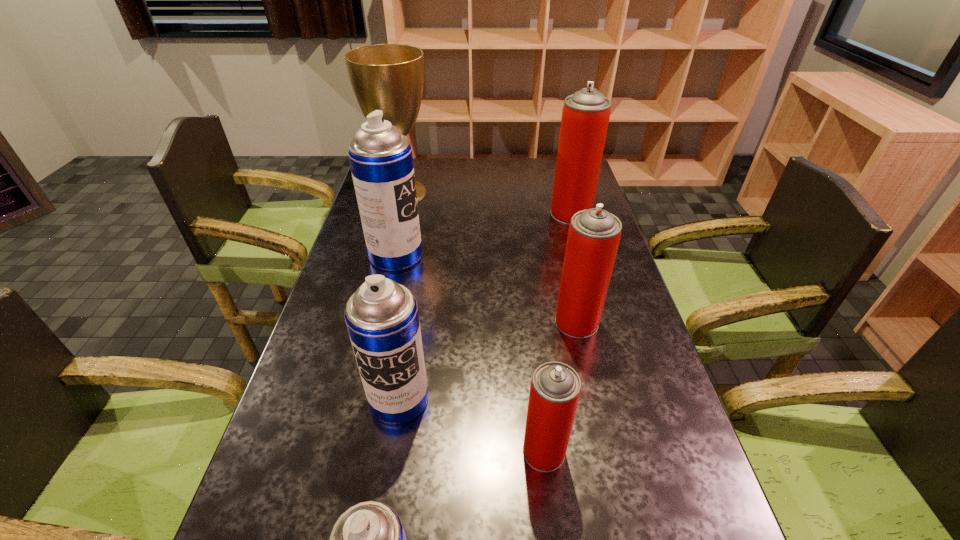
Where is `trophy cup`? The height and width of the screenshot is (540, 960). trophy cup is located at coordinates (389, 77).

At what (x,y) coordinates should I click in order to perform the action: click on the biggest blue aerosol can. Please return your answer as a coordinate pair (x, y). Looking at the image, I should click on (380, 157).

Locate an element on the screen. the third farthest object is located at coordinates (380, 157).

At what (x,y) coordinates should I click in order to perform the action: click on the farthest aerosol can. Please return your answer as a coordinate pair (x, y). This screenshot has height=540, width=960. Looking at the image, I should click on (585, 116).

I want to click on the farthest red aerosol can, so click(585, 116).

Locate an element on the screen. the second nearest red aerosol can is located at coordinates (594, 234).

This screenshot has width=960, height=540. In order to click on the third farthest aerosol can in this screenshot , I will do [594, 234].

I want to click on the third nearest object, so click(382, 318).

Find the location of a particular element. the second smallest blue aerosol can is located at coordinates (382, 318).

Identify the location of the second nearest aerosol can. (555, 389).